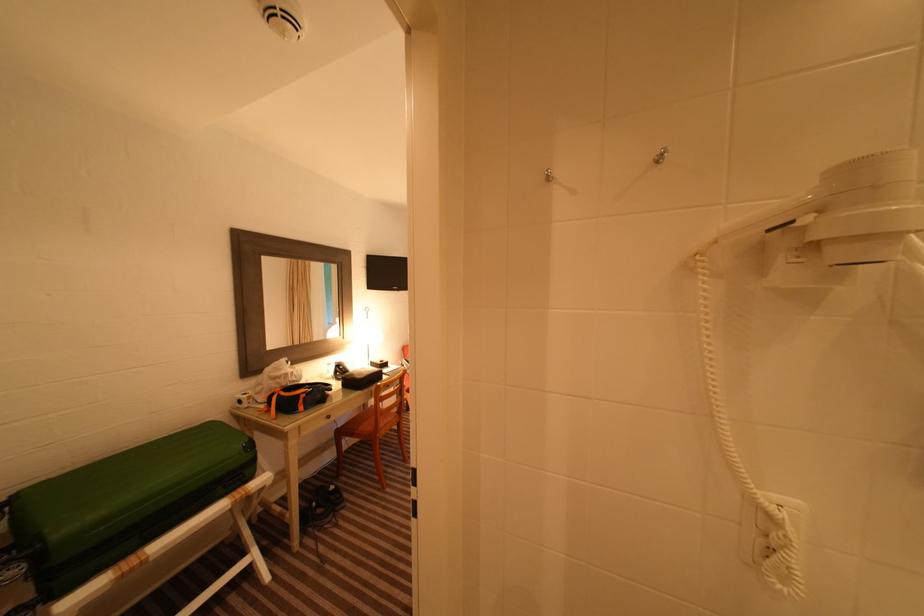
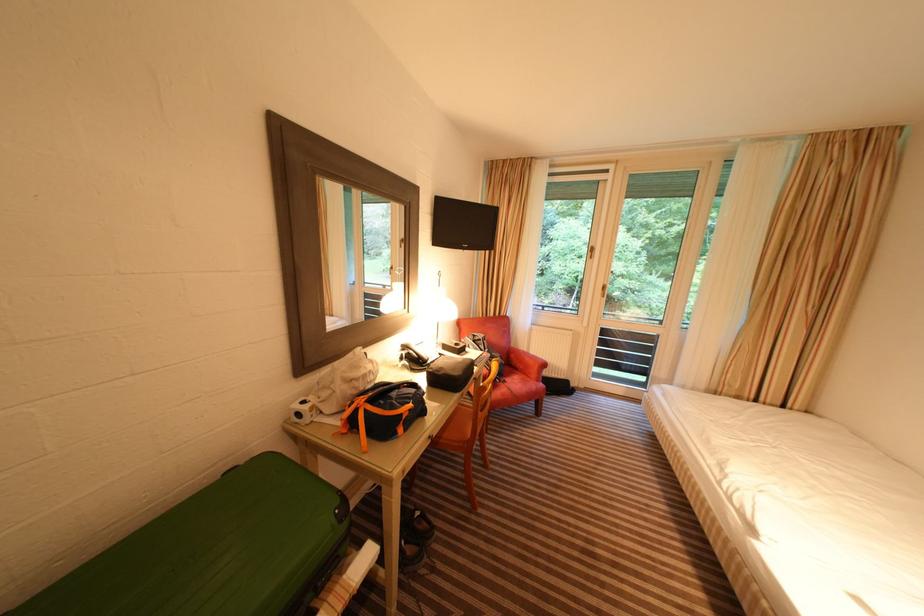
Where in the second image is the point corresponding to the point at 365,395 from the first image?

(463, 399)